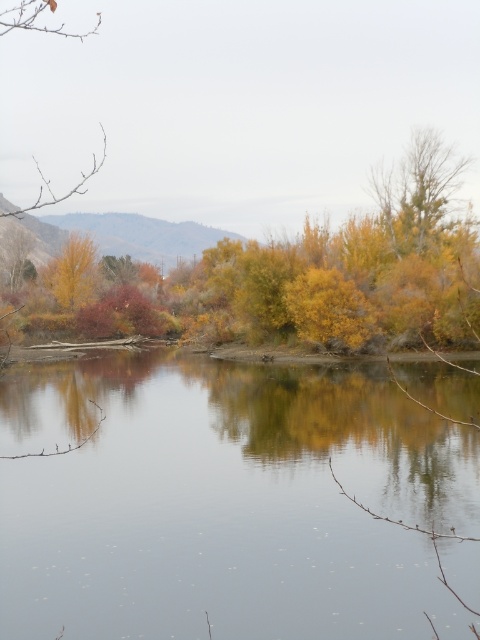
Question: Among these objects, which one is farthest from the camera?

Choices:
 (A) yellow matte tree at upper left
 (B) transparent water at center

Answer: (A)

Question: Is transparent water at center positioned before yellow matte tree at upper left?

Choices:
 (A) no
 (B) yes

Answer: (B)

Question: Which point appears closest to the camera in this image?

Choices:
 (A) coord(78,253)
 (B) coord(408,433)

Answer: (B)

Question: Among these points, which one is nearest to the camera?

Choices:
 (A) (294, 429)
 (B) (72, 248)

Answer: (A)

Question: Is the position of transparent water at center less distant than that of yellow matte tree at upper left?

Choices:
 (A) yes
 (B) no

Answer: (A)

Question: Is the position of transparent water at center less distant than that of yellow matte tree at upper left?

Choices:
 (A) yes
 (B) no

Answer: (A)